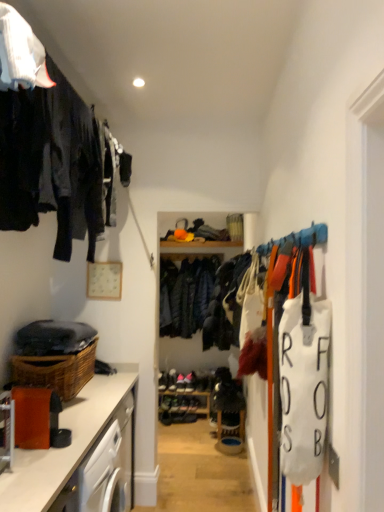
Question: Is woven brown basket at lower left located outside matte brown countertop at lower left?

Choices:
 (A) no
 (B) yes

Answer: (B)

Question: Does woven brown basket at lower left have a smaller size compared to matte brown countertop at lower left?

Choices:
 (A) yes
 (B) no

Answer: (A)

Question: From the image's perspective, is woven brown basket at lower left beneath matte brown countertop at lower left?

Choices:
 (A) yes
 (B) no

Answer: (B)

Question: Can you confirm if woven brown basket at lower left is taller than matte brown countertop at lower left?

Choices:
 (A) no
 (B) yes

Answer: (A)

Question: Is matte brown countertop at lower left inside woven brown basket at lower left?

Choices:
 (A) no
 (B) yes

Answer: (A)

Question: Is woven brown basket at lower left wider than matte brown countertop at lower left?

Choices:
 (A) no
 (B) yes

Answer: (A)

Question: From a real-world perspective, does woven brown basket at lower left sit lower than leather shoe at center, placed as the first shoe when sorted from bottom to top?

Choices:
 (A) no
 (B) yes

Answer: (A)

Question: From the image's perspective, is woven brown basket at lower left over leather shoe at center, arranged as the 4th shoe when viewed from the top?

Choices:
 (A) yes
 (B) no

Answer: (A)

Question: Considering the relative sizes of woven brown basket at lower left and leather shoe at center, placed as the first shoe when sorted from bottom to top, in the image provided, is woven brown basket at lower left thinner than leather shoe at center, placed as the first shoe when sorted from bottom to top,?

Choices:
 (A) yes
 (B) no

Answer: (B)

Question: Is leather shoe at center, placed as the first shoe when sorted from bottom to top, completely or partially inside woven brown basket at lower left?

Choices:
 (A) yes
 (B) no

Answer: (B)

Question: Can you confirm if woven brown basket at lower left is bigger than leather shoe at center, placed as the first shoe when sorted from bottom to top?

Choices:
 (A) no
 (B) yes

Answer: (B)

Question: Could you tell me if woven brown basket at lower left is turned towards leather shoe at center, arranged as the 4th shoe when viewed from the top?

Choices:
 (A) yes
 (B) no

Answer: (B)

Question: Is shiny black shoe at center, placed as the 3th shoe when sorted from top to bottom, touching dark blue woolen jacket at center?

Choices:
 (A) no
 (B) yes

Answer: (A)